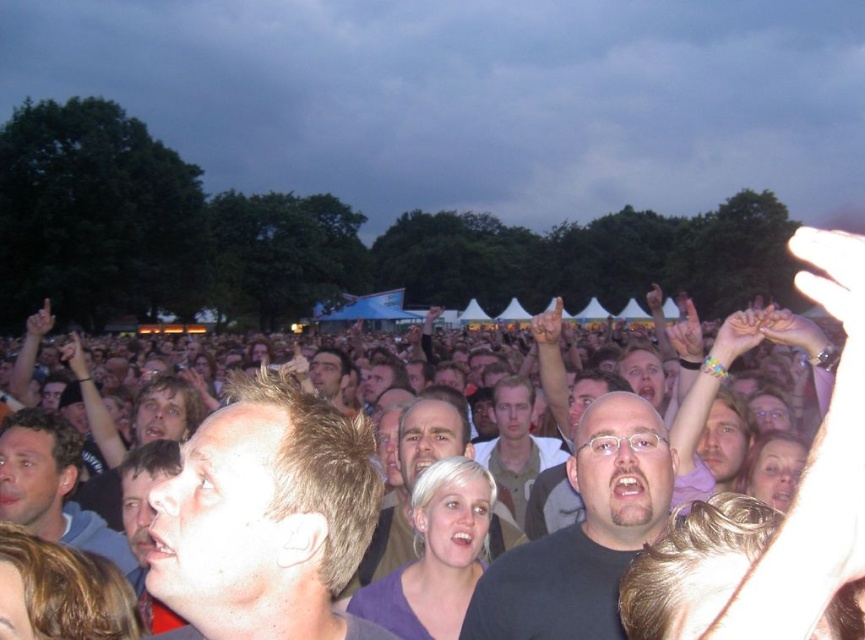
You are a photographer standing at the edge of the crowd at the concert. You want to take a photo of the light brown hair at lower left and the light brown leather jacket at center. The minimum distance your camera can focus on two objects is 3 meters. Will you be able to capture both in focus?

The light brown hair at lower left is 4.03 meters from the light brown leather jacket at center. Since the minimum focusing distance is 3 meters, the camera can focus on both objects as they are farther apart than the required distance.

Based on the photo, you are a photographer at the concert and want to capture a closeup of the black matte shirt at center and smooth brown hair at center. Which object should you zoom in on to ensure it fills more of the frame without moving the camera?

The black matte shirt at center has a greater width than the smooth brown hair at center, so zooming in on the black matte shirt at center will allow it to fill more of the frame.